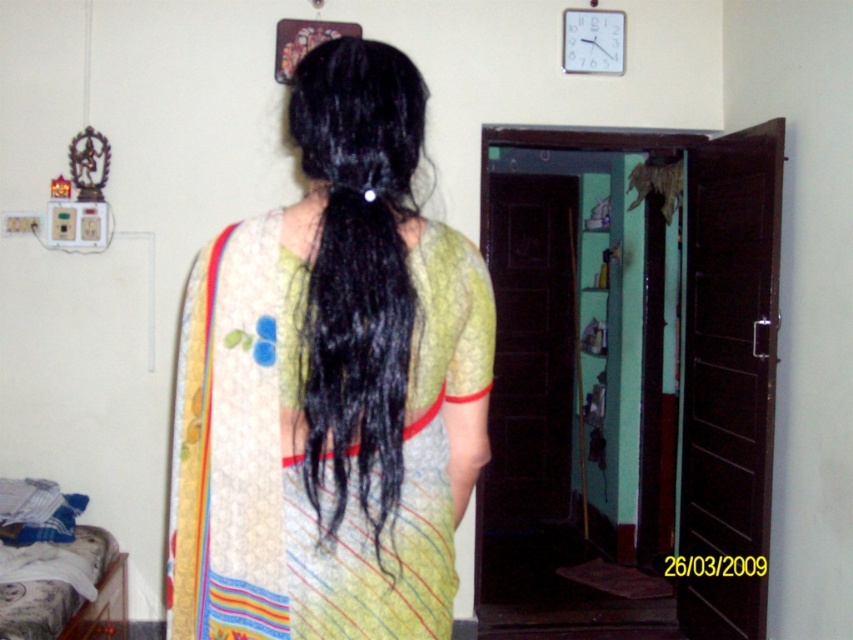
Can you confirm if silky yellow sari at center is thinner than black silky hair at center?

Incorrect, silky yellow sari at center's width is not less than black silky hair at center's.

Is silky yellow sari at center closer to camera compared to black silky hair at center?

Yes, silky yellow sari at center is closer to the viewer.

Describe the element at coordinates (329, 385) in the screenshot. The height and width of the screenshot is (640, 853). I see `silky yellow sari at center` at that location.

This screenshot has width=853, height=640. Find the location of `silky yellow sari at center`. silky yellow sari at center is located at coordinates (329, 385).